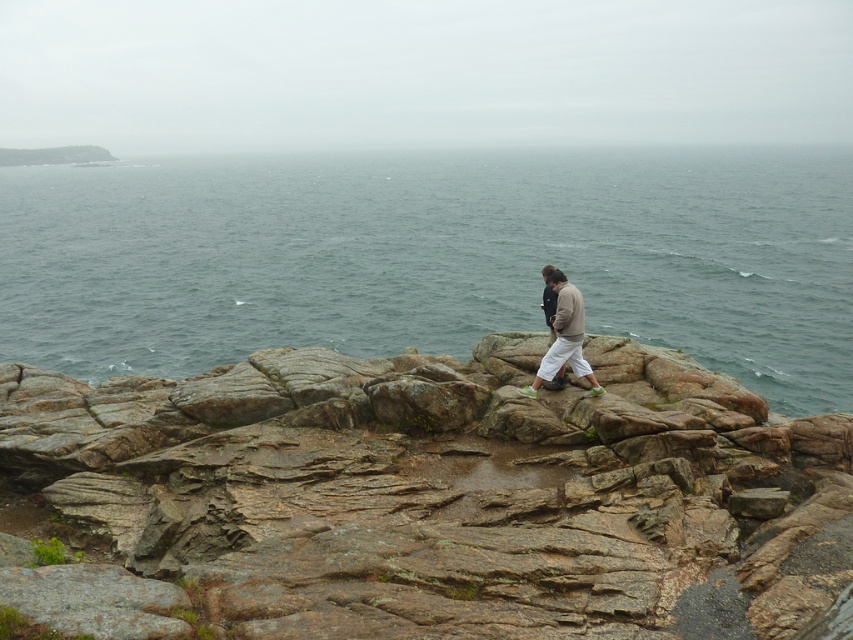
Is greenish-blue water at upper center closer to the viewer compared to light brown cotton pants at center?

That is False.

Does point (82, 276) lie behind point (564, 292)?

Yes, point (82, 276) is farther from viewer.

Is point (612, 173) positioned before point (590, 378)?

No, it is not.

The width and height of the screenshot is (853, 640). Find the location of `greenish-blue water at upper center`. greenish-blue water at upper center is located at coordinates (433, 259).

Consider the image. Between rusty rock at center and light brown cotton pants at center, which one appears on the right side from the viewer's perspective?

light brown cotton pants at center is more to the right.

Is rusty rock at center smaller than light brown cotton pants at center?

No, rusty rock at center is not smaller than light brown cotton pants at center.

Locate an element on the screen. This screenshot has width=853, height=640. rusty rock at center is located at coordinates (421, 499).

Is rusty rock at center shorter than greenish-blue water at upper center?

Yes.

Where is `rusty rock at center`? rusty rock at center is located at coordinates (421, 499).

Locate an element on the screen. rusty rock at center is located at coordinates (421, 499).